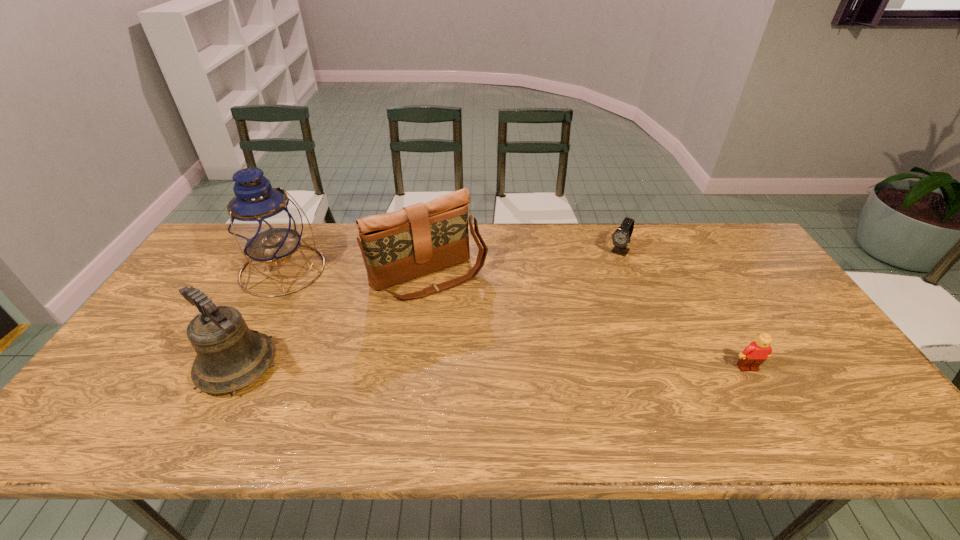
This screenshot has height=540, width=960. I want to click on object that is at the left edge, so click(x=263, y=222).

Image resolution: width=960 pixels, height=540 pixels. Find the location of `object that is at the far left corner`. object that is at the far left corner is located at coordinates (263, 222).

In the image, there is a desktop. At what (x,y) coordinates should I click in order to perform the action: click on vacant space at the far edge. Please return your answer as a coordinate pair (x, y). The image size is (960, 540). Looking at the image, I should click on (513, 256).

This screenshot has width=960, height=540. Identify the location of vacant region at the near edge of the desktop. (533, 383).

In the image, there is a desktop. What are the coordinates of `free space at the left edge` in the screenshot? It's located at (184, 360).

Locate an element on the screen. The image size is (960, 540). free location at the far left corner of the desktop is located at coordinates (211, 265).

In the image, there is a desktop. In order to click on vacant space at the near left corner in this screenshot , I will do `click(137, 387)`.

The height and width of the screenshot is (540, 960). What are the coordinates of `vacant space that's between the bell and the Lego` in the screenshot? It's located at (492, 367).

Locate an element on the screen. The width and height of the screenshot is (960, 540). free space between the bell and the shoulder bag is located at coordinates [333, 321].

At what (x,y) coordinates should I click in order to perform the action: click on vacant space that's between the shoulder bag and the bell. Please return your answer as a coordinate pair (x, y). This screenshot has height=540, width=960. Looking at the image, I should click on (333, 321).